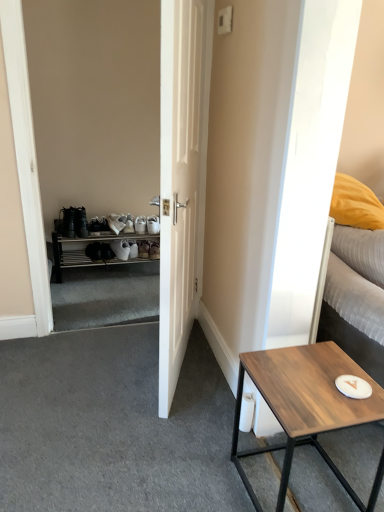
I want to click on free space in front of white plastic shoe rack at left, so click(x=102, y=290).